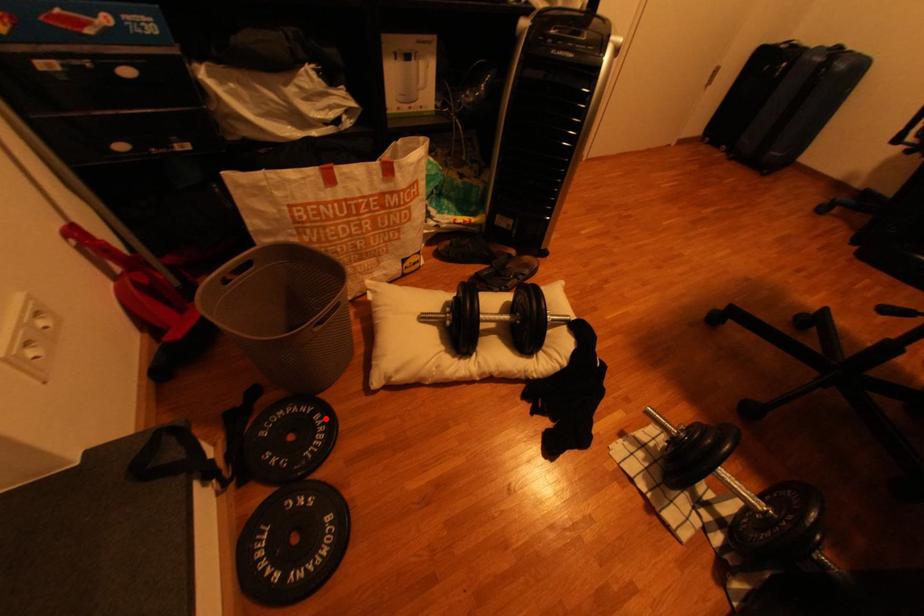
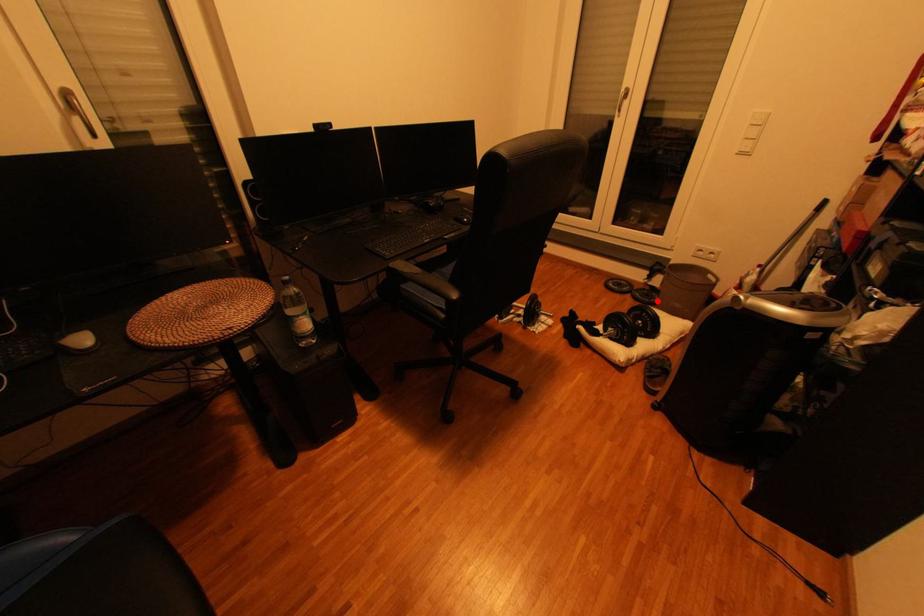
I am providing you with two images of the same scene from different viewpoints. A red point is marked on the first image and another point is marked on the second image. Is the marked point in image1 the same physical position as the marked point in image2?

Yes